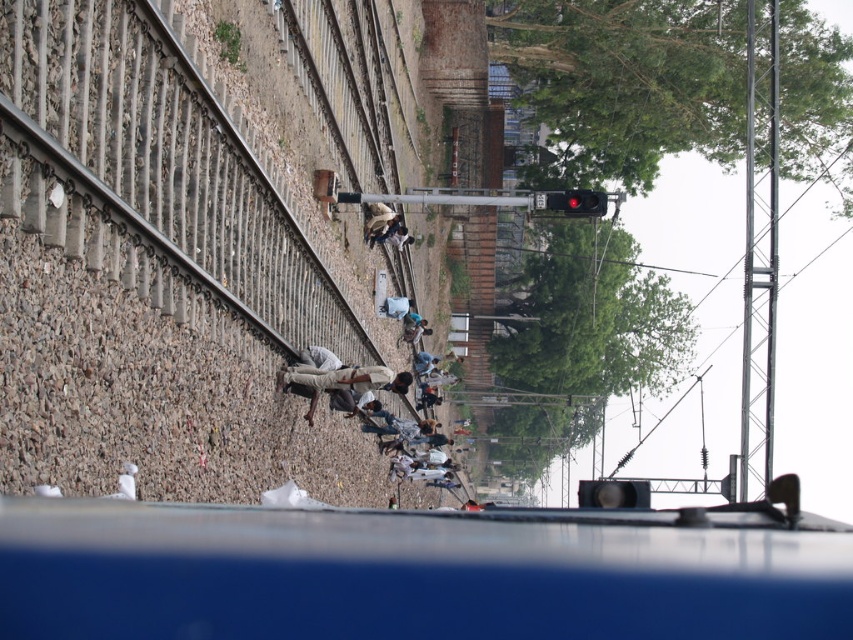
You are a passenger sitting in the train and looking out the window. You notice two fabrics in your view. Which fabric is closer to you, the blue fabric shirt at center or the light beige fabric at center?

The blue fabric shirt at center is closer to you because it is located below the light beige fabric at center, which means it is in a lower position relative to your viewpoint.

You are sitting in the train and looking out the window. You see a blue fabric shirt at center and a light beige fabric at center. Which fabric is closer to you?

The blue fabric shirt at center is closer to you because it is further to the viewer than the light beige fabric at center.

You are standing inside a train and looking out the window. You see two points marked in the scene. Which point is closer to you, the point at coordinates point(422, 369) or point(393, 241)?

The point at coordinates point(422, 369) is closer to you because it is further to the viewer than point(393, 241).